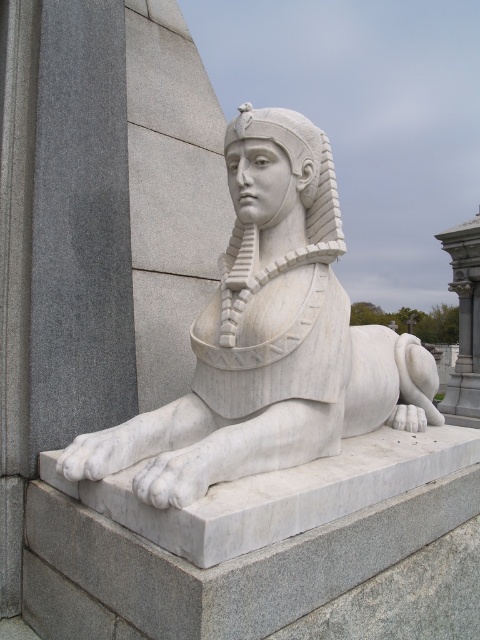
Who is positioned more to the right, white marble sphinx at center or white marble pillar at right?

white marble pillar at right

Does white marble sphinx at center have a lesser width compared to white marble pillar at right?

Incorrect, white marble sphinx at center's width is not less than white marble pillar at right's.

Is point (163, 468) farther from camera compared to point (466, 312)?

No, (163, 468) is in front of (466, 312).

The height and width of the screenshot is (640, 480). Identify the location of white marble sphinx at center. (269, 339).